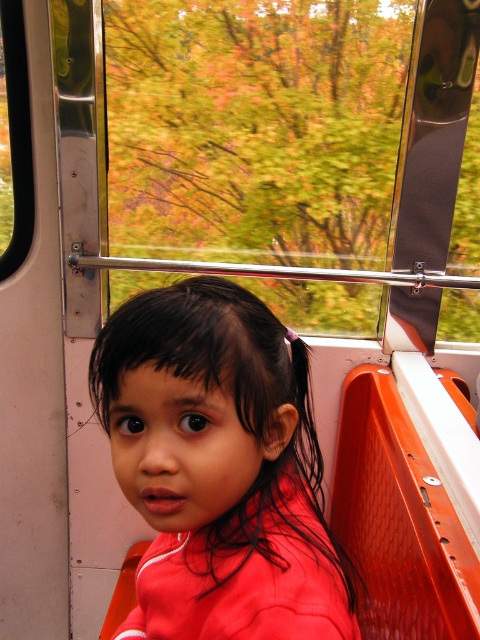
Is transparent glass window at center positioned before matte red shirt at center?

No, it is behind matte red shirt at center.

Can you confirm if transparent glass window at center is positioned to the left of matte red shirt at center?

Incorrect, transparent glass window at center is not on the left side of matte red shirt at center.

Which is in front, point (115, 106) or point (177, 465)?

Point (177, 465) is more forward.

The image size is (480, 640). Identify the location of transparent glass window at center. (254, 129).

Can you confirm if transparent glass window at center is positioned above black plastic window at upper left?

Yes.

Between point (159, 198) and point (29, 244), which one is positioned behind?

The point (159, 198) is behind.

Image resolution: width=480 pixels, height=640 pixels. Find the location of `transparent glass window at center`. transparent glass window at center is located at coordinates (254, 129).

Identify the location of transparent glass window at center. (254, 129).

This screenshot has width=480, height=640. What do you see at coordinates (218, 467) in the screenshot?
I see `matte red shirt at center` at bounding box center [218, 467].

Identify the location of matte red shirt at center. (218, 467).

Where is `matte red shirt at center`? This screenshot has height=640, width=480. matte red shirt at center is located at coordinates (218, 467).